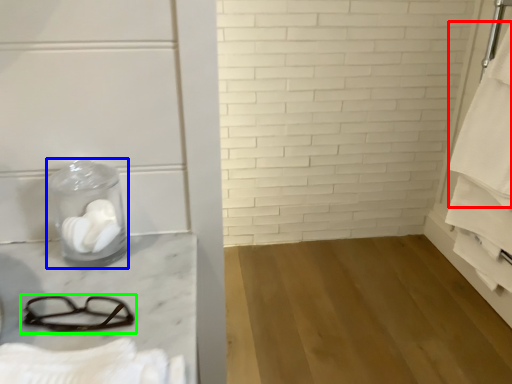
Question: Which object is the farthest from bath towel (highlighted by a red box)? Choose among these: glass jar (highlighted by a blue box) or glasses (highlighted by a green box).

Choices:
 (A) glass jar
 (B) glasses

Answer: (B)